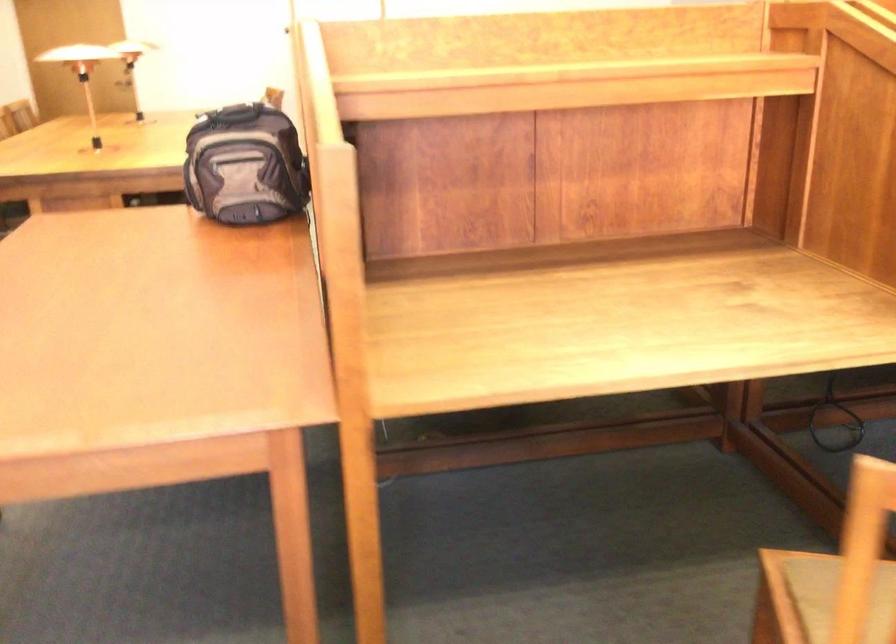
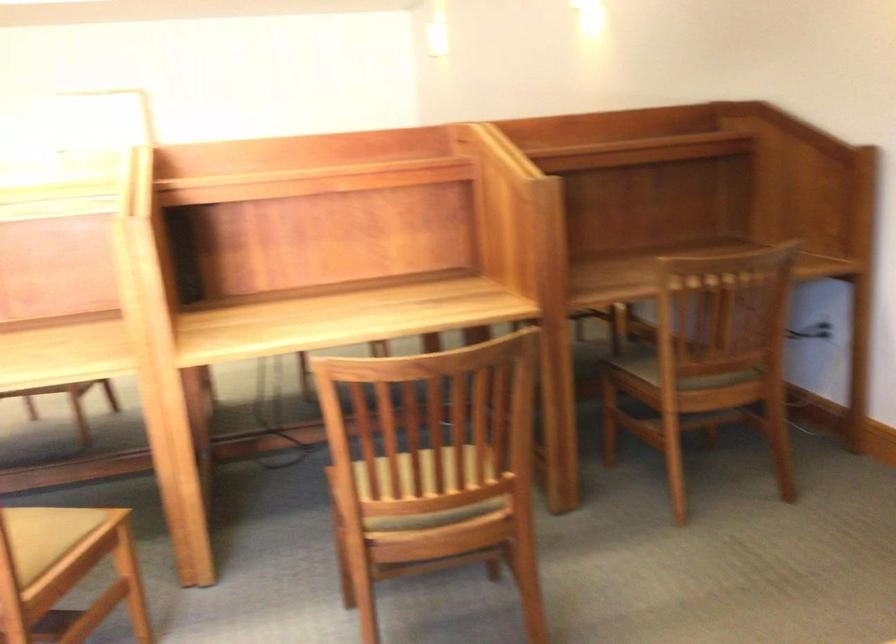
In a continuous first-person perspective shot, in which direction is the camera moving?

The cameraman moved toward right, backward.